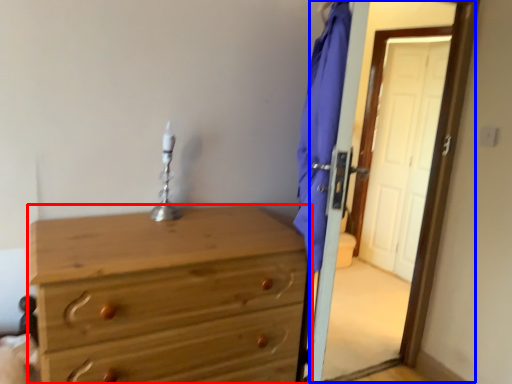
Question: Which object appears closest to the camera in this image, chest of drawers (highlighted by a red box) or screen door (highlighted by a blue box)?

Choices:
 (A) chest of drawers
 (B) screen door

Answer: (A)